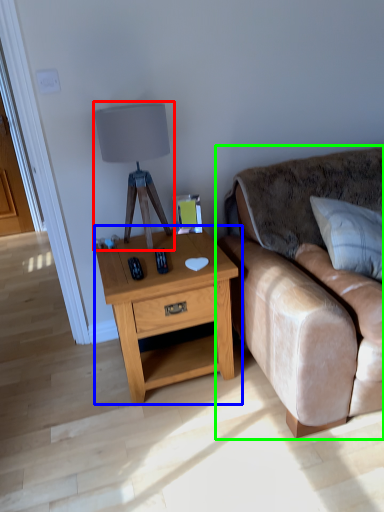
Question: Considering the real-world distances, which object is farthest from table lamp (highlighted by a red box)? nightstand (highlighted by a blue box) or studio couch (highlighted by a green box)?

Choices:
 (A) nightstand
 (B) studio couch

Answer: (B)